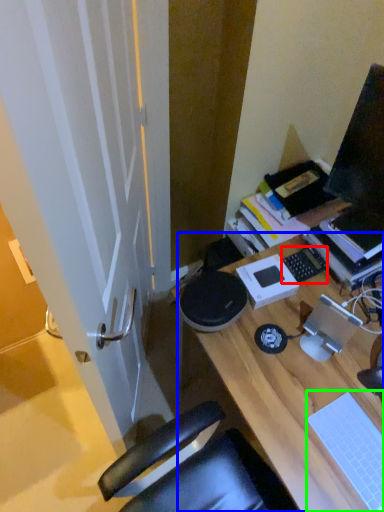
Question: Which object is positioned farthest from laptop keyboard (highlighted by a red box)? Select from desk (highlighted by a blue box) and laptop keyboard (highlighted by a green box).

Choices:
 (A) desk
 (B) laptop keyboard

Answer: (B)